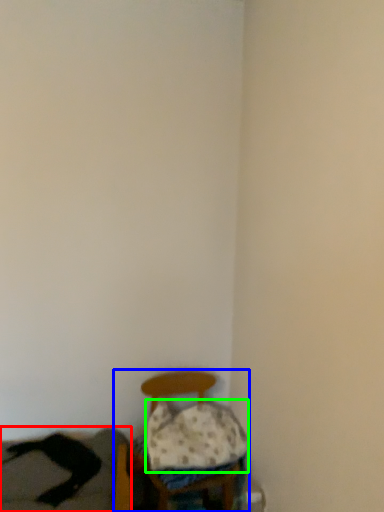
Question: Considering the real-world distances, which object is farthest from couch (highlighted by a red box)? furniture (highlighted by a blue box) or pillow (highlighted by a green box)?

Choices:
 (A) furniture
 (B) pillow

Answer: (B)